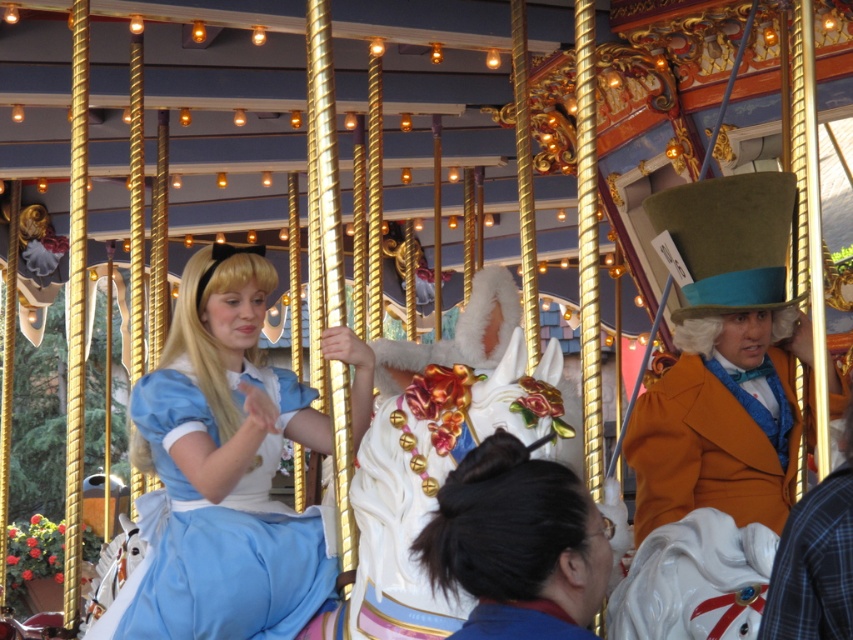
Between point (254, 486) and point (531, 618), which one is positioned in front?

Point (531, 618)

Who is more forward, [294,528] or [524,529]?

Positioned in front is point [524,529].

I want to click on blue satin dress at center, so click(x=222, y=472).

Does smooth brown hair at center have a greater height compared to matte blue dress at center?

Yes.

Where is `smooth brown hair at center`? The width and height of the screenshot is (853, 640). smooth brown hair at center is located at coordinates (517, 545).

Describe the element at coordinates (517, 545) in the screenshot. I see `smooth brown hair at center` at that location.

Locate an element on the screen. Image resolution: width=853 pixels, height=640 pixels. smooth brown hair at center is located at coordinates (517, 545).

Describe the element at coordinates (706, 449) in the screenshot. I see `orange velvet top hat at upper right` at that location.

Between orange velvet top hat at upper right and matte blue dress at center, which one appears on the right side from the viewer's perspective?

orange velvet top hat at upper right is more to the right.

What do you see at coordinates (706, 449) in the screenshot? I see `orange velvet top hat at upper right` at bounding box center [706, 449].

The height and width of the screenshot is (640, 853). In order to click on orange velvet top hat at upper right in this screenshot , I will do `click(706, 449)`.